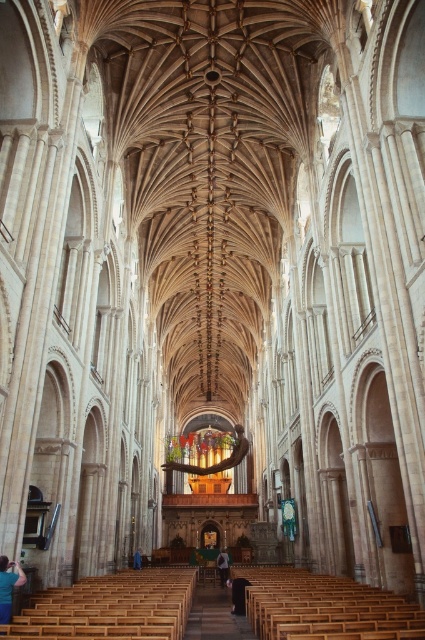
Locate an element on the screen. The height and width of the screenshot is (640, 425). blue fabric person at lower left is located at coordinates (8, 586).

Is blue fabric person at lower left in front of blue fabric at center?

That is True.

Locate an element on the screen. blue fabric person at lower left is located at coordinates (8, 586).

Where is `blue fabric person at lower left`? Image resolution: width=425 pixels, height=640 pixels. blue fabric person at lower left is located at coordinates (8, 586).

Does light blue fabric at center have a greater width compared to blue fabric at center?

Indeed, light blue fabric at center has a greater width compared to blue fabric at center.

The image size is (425, 640). What do you see at coordinates (223, 566) in the screenshot?
I see `light blue fabric at center` at bounding box center [223, 566].

Locate an element on the screen. This screenshot has height=640, width=425. light blue fabric at center is located at coordinates (223, 566).

Is blue fabric person at lower left further to the viewer compared to light blue fabric at center?

No.

Between blue fabric person at lower left and light blue fabric at center, which one appears on the left side from the viewer's perspective?

From the viewer's perspective, blue fabric person at lower left appears more on the left side.

Does point (5, 609) come behind point (226, 573)?

No, it is in front of (226, 573).

Locate an element on the screen. This screenshot has width=425, height=640. blue fabric person at lower left is located at coordinates (8, 586).